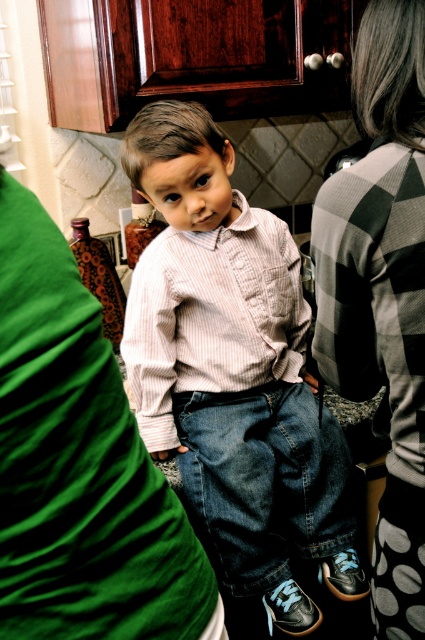
Is point (391, 481) behind point (175, 388)?

No, it is in front of (175, 388).

Looking at this image, between checkered fabric sweater at right and pink striped shirt at center, which one appears on the left side from the viewer's perspective?

pink striped shirt at center

Who is more forward, (408, 522) or (189, 244)?

Positioned in front is point (408, 522).

At what (x,y) coordinates should I click in order to perform the action: click on checkered fabric sweater at right. Please return your answer as a coordinate pair (x, y). The image size is (425, 640). Looking at the image, I should click on (382, 292).

Which is more to the right, striped cotton shirt at center or pink striped shirt at center?

From the viewer's perspective, striped cotton shirt at center appears more on the right side.

Which is behind, point (351, 596) or point (266, 362)?

The point (266, 362) is behind.

The image size is (425, 640). In order to click on striped cotton shirt at center in this screenshot , I will do `click(234, 371)`.

Does striped cotton shirt at center appear under checkered fabric sweater at right?

Correct, striped cotton shirt at center is located below checkered fabric sweater at right.

Who is positioned more to the right, striped cotton shirt at center or checkered fabric sweater at right?

checkered fabric sweater at right is more to the right.

Is point (243, 280) positioned before point (404, 198)?

That is False.

Find the location of `striped cotton shirt at center`. striped cotton shirt at center is located at coordinates (234, 371).